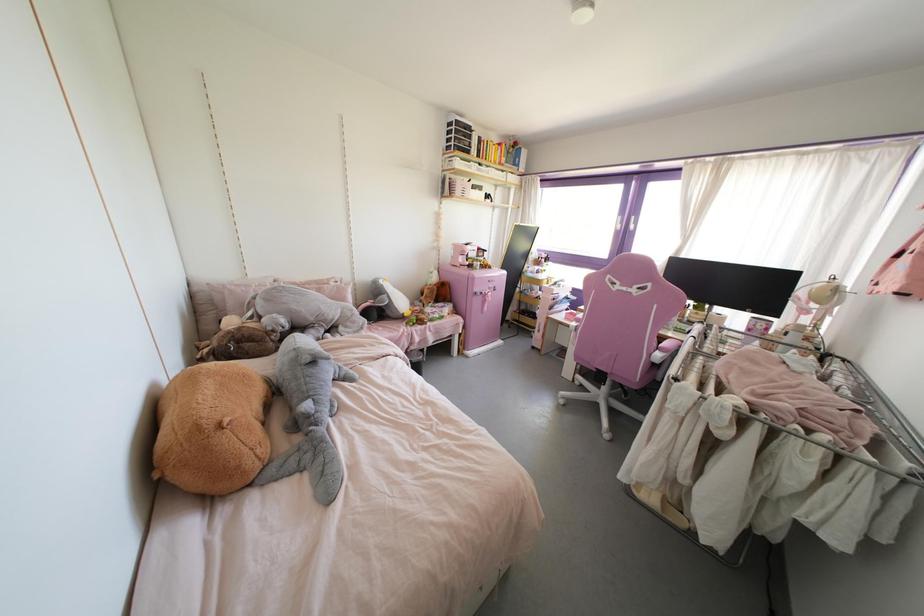
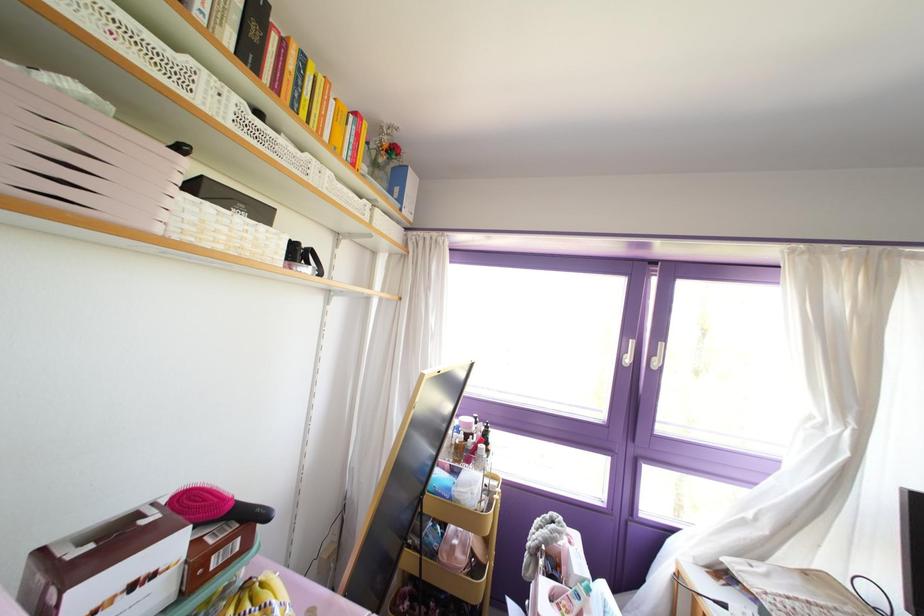
The point at (617, 225) is marked in the first image. Where is the corresponding point in the second image?

(626, 360)